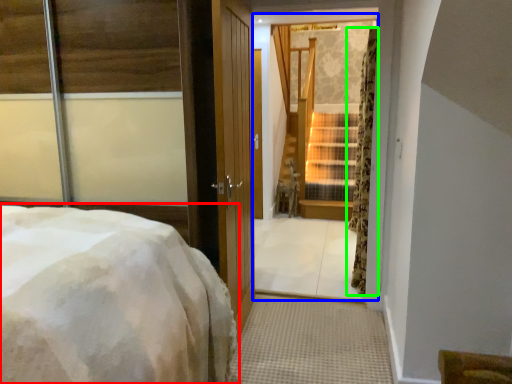
Question: Which object is the closest to the bed (highlighted by a red box)? Choose among these: window (highlighted by a blue box) or curtain (highlighted by a green box).

Choices:
 (A) window
 (B) curtain

Answer: (B)